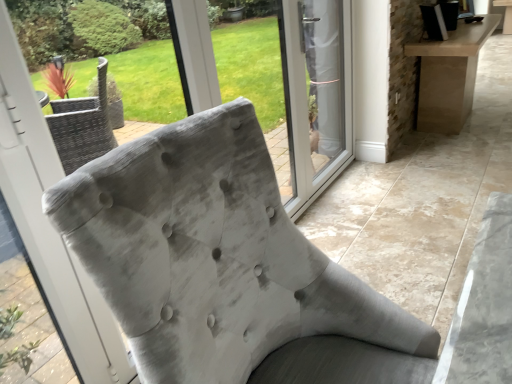
Image resolution: width=512 pixels, height=384 pixels. Identify the location of free space below transparent glass door at center (from a real-world perspective). (329, 183).